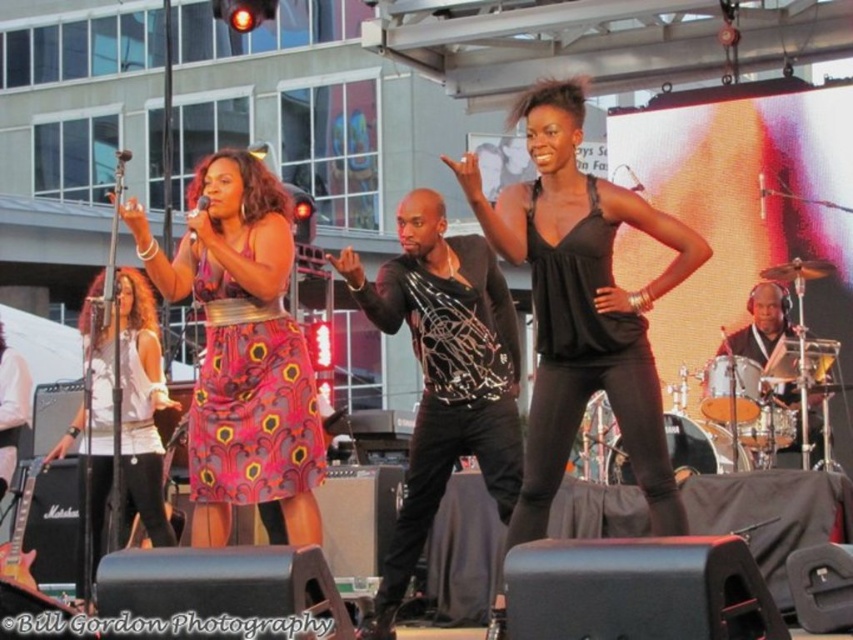
Question: Can you confirm if black matte tank top at center is thinner than pink printed dress at center?

Choices:
 (A) no
 (B) yes

Answer: (B)

Question: Is pink printed fabric dress at center wider than pink floral dress at center?

Choices:
 (A) no
 (B) yes

Answer: (A)

Question: Which object is the closest to the black matte tank top at center?

Choices:
 (A) pink printed fabric dress at center
 (B) pink floral dress at center

Answer: (A)

Question: Estimate the real-world distances between objects in this image. Which object is closer to the shiny black drum set at right?

Choices:
 (A) black shiny shirt at center
 (B) pink printed dress at center
 (C) pink printed fabric dress at center
 (D) pink floral dress at center

Answer: (A)

Question: Is black matte tank top at center in front of black shiny shirt at center?

Choices:
 (A) yes
 (B) no

Answer: (A)

Question: Which object appears farthest from the camera in this image?

Choices:
 (A) shiny black drum set at right
 (B) pink printed dress at center
 (C) pink printed fabric dress at center
 (D) pink floral dress at center

Answer: (A)